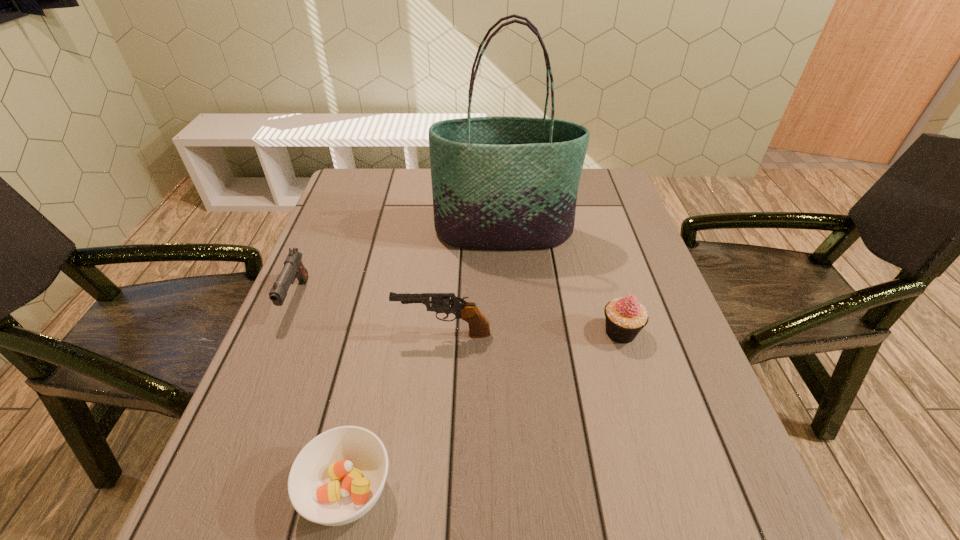
Image resolution: width=960 pixels, height=540 pixels. I want to click on vacant space that satisfies the following two spatial constraints: 1. in the direction the cupcake is aimed; 2. on the right side of the farther gun, so click(x=282, y=332).

The image size is (960, 540). Find the location of `vacant space that satisfies the following two spatial constraints: 1. along the barrel of the taller gun; 2. in the direction the left gun is aimed`. vacant space that satisfies the following two spatial constraints: 1. along the barrel of the taller gun; 2. in the direction the left gun is aimed is located at coordinates click(446, 298).